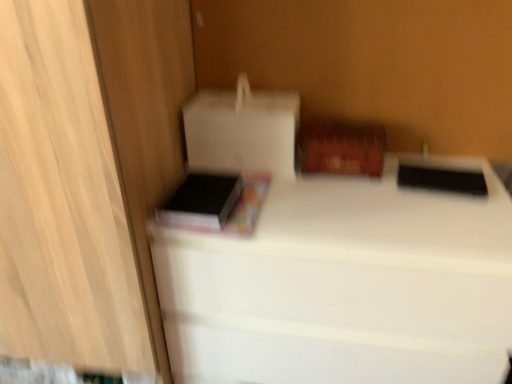
The height and width of the screenshot is (384, 512). I want to click on free space between black matte book at left and white matte cardboard box at upper left, marked as the 2th cardboard box in a right-to-left arrangement, so click(259, 193).